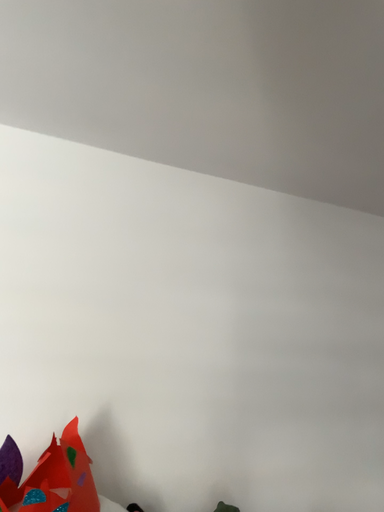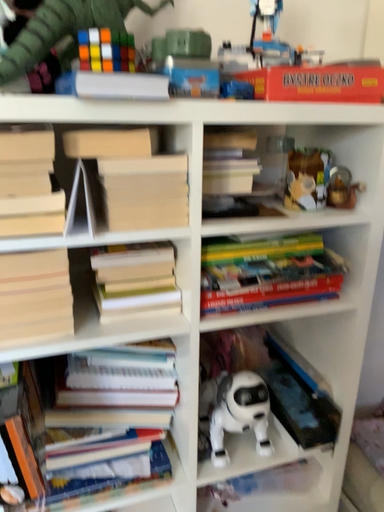
Question: Which way did the camera rotate in the video?

Choices:
 (A) rotated downward
 (B) rotated upward

Answer: (A)